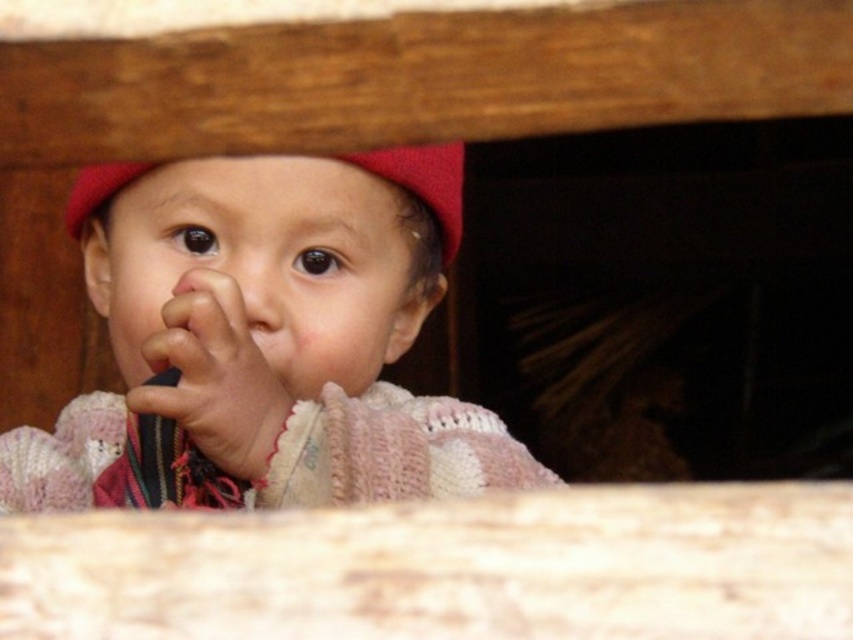
Is knitted pink sweater at center behind red knitted hat at center?

That is True.

Is knitted pink sweater at center shorter than red knitted hat at center?

No, knitted pink sweater at center is not shorter than red knitted hat at center.

Does point (262, 483) lie behind point (428, 148)?

No, (262, 483) is closer to viewer.

Where is `knitted pink sweater at center`? The width and height of the screenshot is (853, 640). knitted pink sweater at center is located at coordinates (271, 333).

Does soft pink fabric hand at center have a greater width compared to smooth flesh nose at center?

Incorrect, soft pink fabric hand at center's width does not surpass smooth flesh nose at center's.

Does point (247, 451) lie in front of point (224, 285)?

No, it is not.

Identify the location of soft pink fabric hand at center. (213, 376).

At what (x,y) coordinates should I click in order to perform the action: click on knitted pink sweater at center. Please return your answer as a coordinate pair (x, y). Looking at the image, I should click on (271, 333).

Does knitted pink sweater at center lie behind smooth flesh nose at center?

No.

Describe the element at coordinates (271, 333) in the screenshot. The image size is (853, 640). I see `knitted pink sweater at center` at that location.

Where is `knitted pink sweater at center`? knitted pink sweater at center is located at coordinates (271, 333).